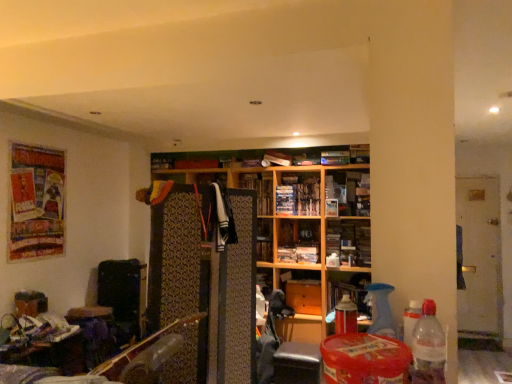
Measure the distance between point (441, 335) and camera.

Point (441, 335) and camera are 1.08 meters apart.

At what (x,y) coordinates should I click in order to perform the action: click on white glossy door at right. Please return your answer as a coordinate pair (x, y). The width and height of the screenshot is (512, 384). Looking at the image, I should click on (479, 257).

This screenshot has width=512, height=384. What do you see at coordinates (347, 291) in the screenshot? I see `matte wood cabinet at center, arranged as the second cabinet when viewed from the left` at bounding box center [347, 291].

Looking at this image, what is the approximate height of wooden bookshelf at center, which is counted as the third book, starting from the top?

43.19 centimeters.

This screenshot has width=512, height=384. What are the coordinates of `clear plastic bottle at lower right` in the screenshot? It's located at [428, 347].

From a real-world perspective, is wooden cabinet at center, the 2th cabinet when ordered from right to left, positioned over matte wood cabinet at center, the 1th cabinet when ordered from right to left, based on gravity?

No, from a real-world perspective, wooden cabinet at center, the 2th cabinet when ordered from right to left, is not on top of matte wood cabinet at center, the 1th cabinet when ordered from right to left.

Is wooden cabinet at center, the 2th cabinet when ordered from right to left, positioned beyond the bounds of matte wood cabinet at center, the 1th cabinet when ordered from right to left?

Indeed, wooden cabinet at center, the 2th cabinet when ordered from right to left, is completely outside matte wood cabinet at center, the 1th cabinet when ordered from right to left.

Consider the image. In terms of width, does wooden cabinet at center, the 2th cabinet when ordered from right to left, look wider or thinner when compared to matte wood cabinet at center, the 1th cabinet when ordered from right to left?

Considering their sizes, wooden cabinet at center, the 2th cabinet when ordered from right to left, looks slimmer than matte wood cabinet at center, the 1th cabinet when ordered from right to left.

The image size is (512, 384). Identify the location of cabinet behind the matte wood cabinet at center, the 1th cabinet when ordered from right to left. (302, 290).

Which object is thinner, matte plastic books at center, the second book positioned from the top, or white glossy door at right?

white glossy door at right is thinner.

Is matte plastic books at center, acting as the 2th book starting from the bottom, located outside white glossy door at right?

Yes.

Could you measure the distance between matte plastic books at center, acting as the 2th book starting from the bottom, and white glossy door at right?

They are 2.36 meters apart.

Are matte plastic books at center, acting as the 2th book starting from the bottom, and white glossy door at right far apart?

Yes.

In terms of size, does matte wood cabinet at center, the 1th cabinet when ordered from right to left, appear bigger or smaller than matte white book at upper center, the first book in the top-to-bottom sequence?

Clearly, matte wood cabinet at center, the 1th cabinet when ordered from right to left, is larger in size than matte white book at upper center, the first book in the top-to-bottom sequence.

You are a GUI agent. You are given a task and a screenshot of the screen. Output one action in this format:
    pyautogui.click(x=<x>, y=<y>)
    Task: Click on the cabinet that is the 2nd object to the right of the matte white book at upper center, the 3th book when ordered from bottom to top, starting at the anchor
    Image resolution: width=512 pixels, height=384 pixels.
    Given the screenshot: What is the action you would take?
    pyautogui.click(x=347, y=291)

Are matte wood cabinet at center, the 1th cabinet when ordered from right to left, and matte white book at upper center, the first book in the top-to-bottom sequence, making contact?

matte wood cabinet at center, the 1th cabinet when ordered from right to left, is not next to matte white book at upper center, the first book in the top-to-bottom sequence, and they're not touching.

What's the angular difference between matte wood cabinet at center, the 1th cabinet when ordered from right to left, and matte white book at upper center, the first book in the top-to-bottom sequence,'s facing directions?

The angle between the facing direction of matte wood cabinet at center, the 1th cabinet when ordered from right to left, and the facing direction of matte white book at upper center, the first book in the top-to-bottom sequence, is 0.379 degrees.

Is matte wood cabinet at center, arranged as the second cabinet when viewed from the left, facing towards clear plastic bottle at lower right?

Yes, matte wood cabinet at center, arranged as the second cabinet when viewed from the left, is oriented towards clear plastic bottle at lower right.

From a real-world perspective, who is located higher, matte wood cabinet at center, arranged as the second cabinet when viewed from the left, or clear plastic bottle at lower right?

In real-world perspective, clear plastic bottle at lower right is above.

Could clear plastic bottle at lower right be considered to be inside matte wood cabinet at center, the 1th cabinet when ordered from right to left?

No, matte wood cabinet at center, the 1th cabinet when ordered from right to left, does not contain clear plastic bottle at lower right.

Is wooden cabinet at center, the 2th cabinet when ordered from right to left, wider than wooden bookshelf at center?

No, wooden cabinet at center, the 2th cabinet when ordered from right to left, is not wider than wooden bookshelf at center.

In the image, is wooden cabinet at center, the 2th cabinet when ordered from right to left, on the left side or the right side of wooden bookshelf at center?

wooden cabinet at center, the 2th cabinet when ordered from right to left, is to the right of wooden bookshelf at center.

Locate an element on the screen. Image resolution: width=512 pixels, height=384 pixels. shelf that appears above the wooden cabinet at center, the 2th cabinet when ordered from right to left (from a real-world perspective) is located at coordinates (295, 219).

From a real-world perspective, is wooden cabinet at center, marked as the 1th cabinet in a left-to-right arrangement, positioned over wooden bookshelf at center based on gravity?

No, from a real-world perspective, wooden cabinet at center, marked as the 1th cabinet in a left-to-right arrangement, is not above wooden bookshelf at center.

Is wooden bookshelf at center positioned with its back to wooden cabinet at center, marked as the 1th cabinet in a left-to-right arrangement?

Yes, wooden bookshelf at center is facing away from wooden cabinet at center, marked as the 1th cabinet in a left-to-right arrangement.

From the image's perspective, is wooden bookshelf at center on wooden cabinet at center, marked as the 1th cabinet in a left-to-right arrangement?

Yes, from the image's perspective, wooden bookshelf at center is over wooden cabinet at center, marked as the 1th cabinet in a left-to-right arrangement.

Is there a large distance between wooden bookshelf at center and wooden cabinet at center, marked as the 1th cabinet in a left-to-right arrangement?

That's not correct — wooden bookshelf at center is a little close to wooden cabinet at center, marked as the 1th cabinet in a left-to-right arrangement.

From the wooden bookshelf at center, count 1st cabinet to the right and point to it. Please provide its 2D coordinates.

[(302, 290)]

Considering the points (292, 192) and (281, 161), which point is behind, point (292, 192) or point (281, 161)?

Positioned behind is point (292, 192).

Are matte plastic books at center, the second book positioned from the top, and matte white book at upper center, the 3th book when ordered from bottom to top, beside each other?

No.

Consider the image. Considering the sizes of objects matte plastic books at center, acting as the 2th book starting from the bottom, and matte white book at upper center, the 3th book when ordered from bottom to top, in the image provided, who is taller, matte plastic books at center, acting as the 2th book starting from the bottom, or matte white book at upper center, the 3th book when ordered from bottom to top,?

matte plastic books at center, acting as the 2th book starting from the bottom, is taller.

Does matte plastic books at center, the second book positioned from the top, have a larger size compared to matte white book at upper center, the first book in the top-to-bottom sequence?

Yes.

The height and width of the screenshot is (384, 512). In order to click on cabinet that is behind the matte wood cabinet at center, arranged as the second cabinet when viewed from the left in this screenshot , I will do `click(302, 290)`.

Locate an element on the screen. book that is the 2nd object located above the white glossy door at right (from the image's perspective) is located at coordinates (298, 196).

Looking at the image, which one is located closer to matte white book at upper center, the 3th book when ordered from bottom to top, wooden bookshelf at center, which is counted as the third book, starting from the top, or wooden bookshelf at center?

wooden bookshelf at center lies closer to matte white book at upper center, the 3th book when ordered from bottom to top, than the other object.

From the image, which object appears to be nearer to matte white book at upper center, the 3th book when ordered from bottom to top, wooden bookshelf at center, which is counted as the third book, starting from the top, or white glossy door at right?

wooden bookshelf at center, which is counted as the third book, starting from the top, is closer to matte white book at upper center, the 3th book when ordered from bottom to top.

Based on their spatial positions, is wooden bookshelf at center, which is the first book from bottom to top, or matte plastic books at center, acting as the 2th book starting from the bottom, closer to white glossy door at right?

Among the two, wooden bookshelf at center, which is the first book from bottom to top, is located nearer to white glossy door at right.

Based on their spatial positions, is white glossy door at right or wooden bookshelf at center further from matte plastic books at center, the second book positioned from the top?

white glossy door at right.

Based on the photo, when comparing their distances from wooden cabinet at center, the 2th cabinet when ordered from right to left, does matte white book at upper center, the 3th book when ordered from bottom to top, or clear plastic bottle at lower right seem closer?

matte white book at upper center, the 3th book when ordered from bottom to top, lies closer to wooden cabinet at center, the 2th cabinet when ordered from right to left, than the other object.

From the image, which object appears to be farther from matte wood cabinet at center, arranged as the second cabinet when viewed from the left, clear plastic bottle at lower right or white glossy door at right?

Based on the image, clear plastic bottle at lower right appears to be further to matte wood cabinet at center, arranged as the second cabinet when viewed from the left.

Based on their spatial positions, is clear plastic bottle at lower right or wooden cabinet at center, marked as the 1th cabinet in a left-to-right arrangement, further from white glossy door at right?

Based on the image, clear plastic bottle at lower right appears to be further to white glossy door at right.

Which object lies nearer to the anchor point wooden bookshelf at center, which is the first book from bottom to top, white glossy door at right or wooden bookshelf at center?

Among the two, wooden bookshelf at center is located nearer to wooden bookshelf at center, which is the first book from bottom to top.

Where is `shelf between clear plastic bottle at lower right and wooden bookshelf at center, which is the first book from bottom to top, along the z-axis`? shelf between clear plastic bottle at lower right and wooden bookshelf at center, which is the first book from bottom to top, along the z-axis is located at coordinates (295, 219).

This screenshot has width=512, height=384. Identify the location of book between clear plastic bottle at lower right and wooden bookshelf at center, which is the first book from bottom to top, from front to back. (277, 158).

Where is `cabinet between matte plastic books at center, acting as the 2th book starting from the bottom, and wooden cabinet at center, the 2th cabinet when ordered from right to left, from top to bottom`? The width and height of the screenshot is (512, 384). cabinet between matte plastic books at center, acting as the 2th book starting from the bottom, and wooden cabinet at center, the 2th cabinet when ordered from right to left, from top to bottom is located at coordinates (347, 291).

The image size is (512, 384). What are the coordinates of `book between wooden bookshelf at center, which is counted as the third book, starting from the top, and white glossy door at right, in the horizontal direction` in the screenshot? It's located at (298, 196).